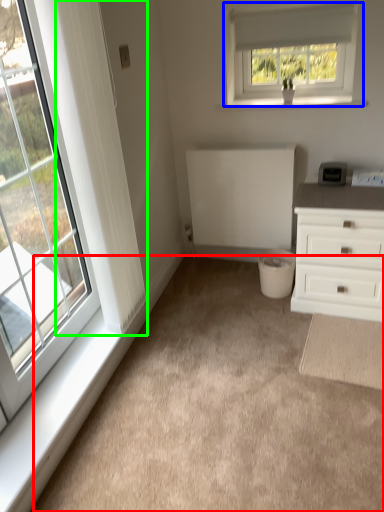
Question: Which object is the farthest from plain (highlighted by a red box)? Choose among these: window (highlighted by a blue box) or curtain (highlighted by a green box).

Choices:
 (A) window
 (B) curtain

Answer: (A)